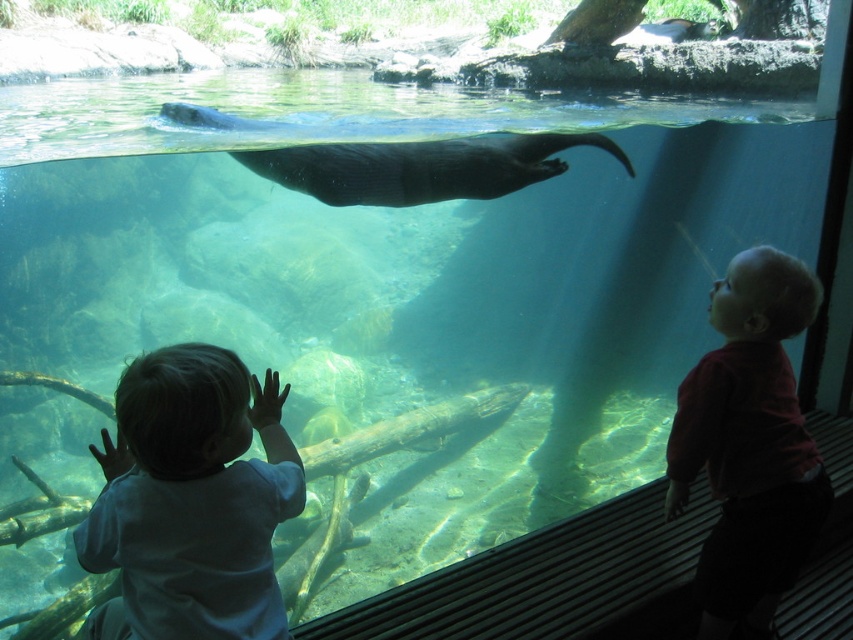
Question: Among these objects, which one is farthest from the camera?

Choices:
 (A) dark gray fur seal at upper center
 (B) light blue shirt at left

Answer: (A)

Question: Which point is farther to the camera?

Choices:
 (A) smooth red shirt at right
 (B) light blue shirt at left
 (C) dark gray fur seal at upper center

Answer: (C)

Question: Is light blue shirt at left closer to camera compared to dark gray fur seal at upper center?

Choices:
 (A) no
 (B) yes

Answer: (B)

Question: Can you confirm if light blue shirt at left is positioned to the left of smooth red shirt at right?

Choices:
 (A) yes
 (B) no

Answer: (A)

Question: From the image, what is the correct spatial relationship of light blue shirt at left in relation to dark gray fur seal at upper center?

Choices:
 (A) left
 (B) right

Answer: (A)

Question: Which object is closer to the camera taking this photo?

Choices:
 (A) smooth red shirt at right
 (B) dark gray fur seal at upper center

Answer: (A)